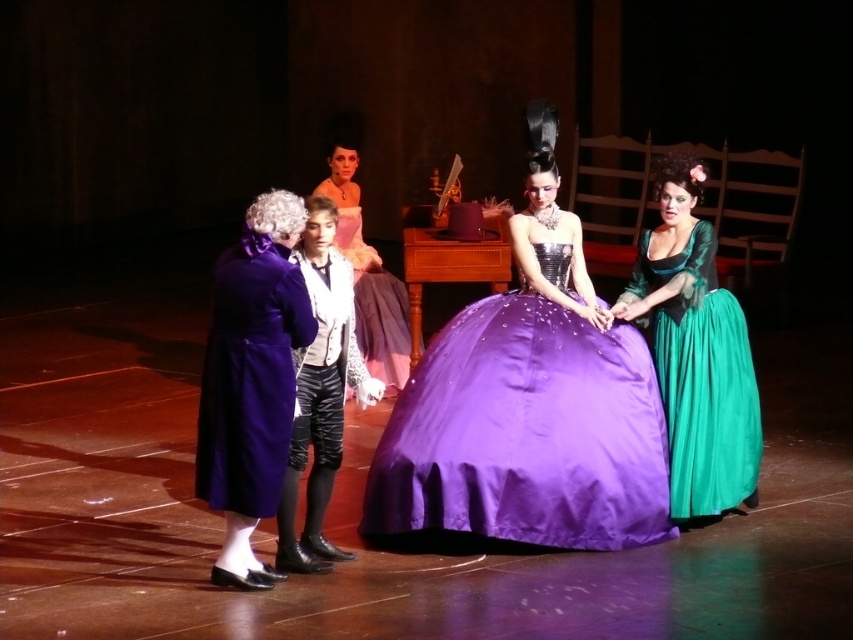
Question: Which point is closer to the camera taking this photo?

Choices:
 (A) (291, 266)
 (B) (669, 428)

Answer: (A)

Question: Does satin purple dress at center have a greater width compared to leather pants at center?

Choices:
 (A) no
 (B) yes

Answer: (B)

Question: Does velvet purple coat at left have a larger size compared to matte white dress at center?

Choices:
 (A) no
 (B) yes

Answer: (A)

Question: Which point appears farthest from the camera in this image?

Choices:
 (A) (552, 371)
 (B) (363, 349)

Answer: (B)

Question: Estimate the real-world distances between objects in this image. Which object is closer to the green satin dress at right?

Choices:
 (A) velvet purple coat at left
 (B) satin purple dress at center

Answer: (B)

Question: Does satin purple dress at center appear on the left side of velvet purple coat at left?

Choices:
 (A) no
 (B) yes

Answer: (A)